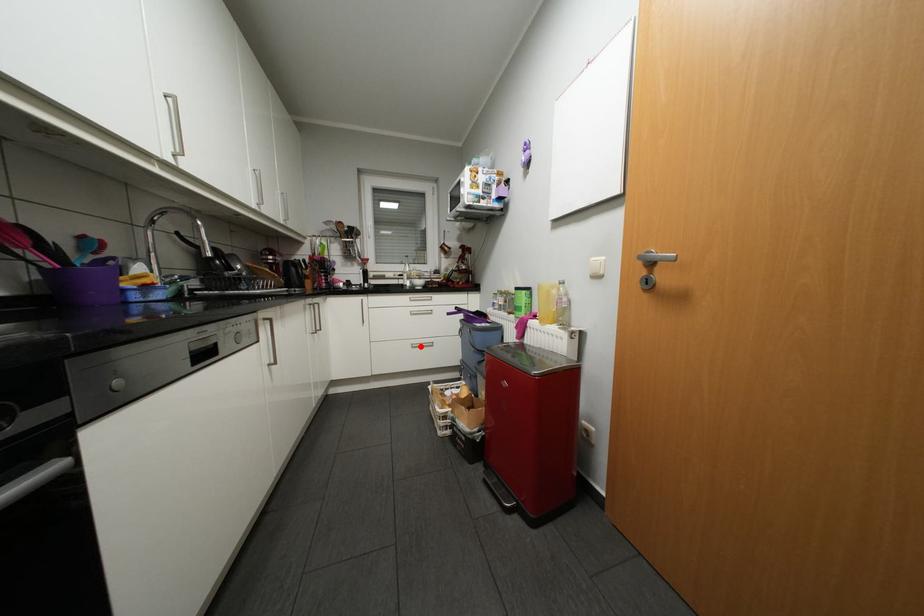
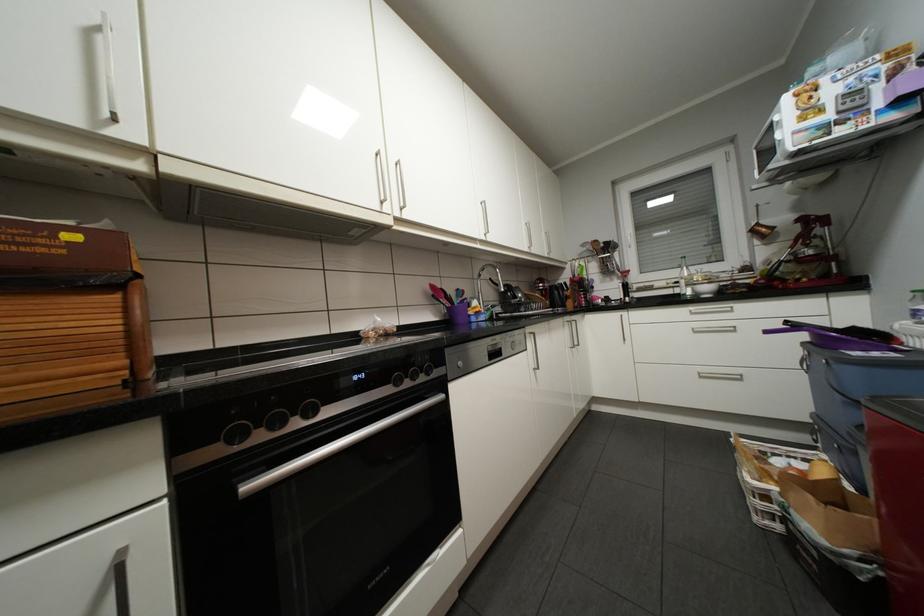
Find the pixel in the second image that matches the highlighted location in the first image.

(709, 377)